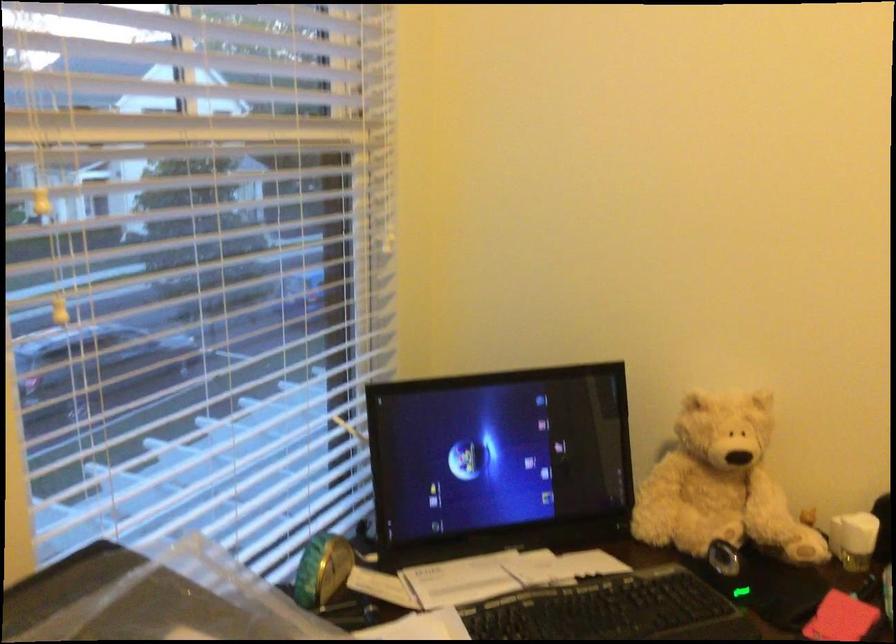
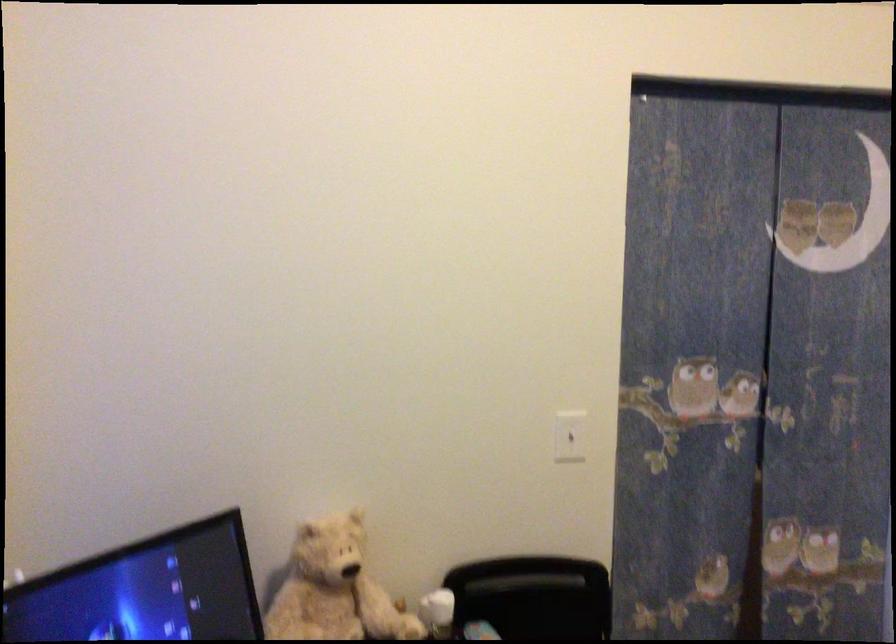
Where in the second image is the point corresponding to [728,464] from the first image?

(334, 589)